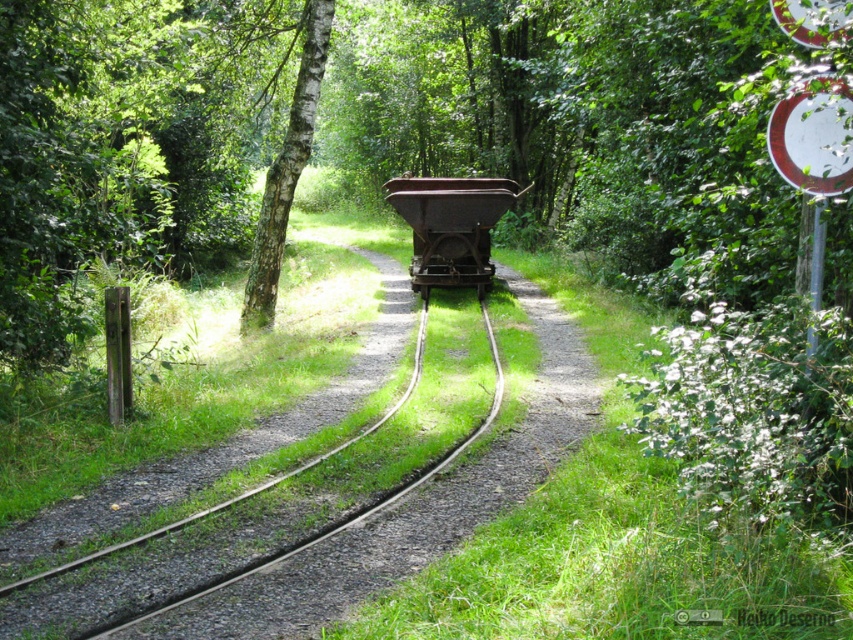
You are a maintenance worker assigned to inspect two rusty metal carts on a railway track. You are standing at the entrance of the track and see the rusty metal train cart at center and the rusty metal cart at center. How far apart are these two carts?

The distance between the rusty metal train cart at center and the rusty metal cart at center is 24.67 feet.

You are standing at the point marked by the coordinates point (451, 227). Looking towards the direction of the railway tracks, which object is directly in front of you?

The rusty metal cart at center is represented by point (451, 227), so the object directly in front of you at that point is the rusty metal cart at center.

You are a photographer standing at the edge of the forest near the railway tracks. You want to take a photo that includes both the rusty metal train cart at center and the rusty metal cart at center. Which cart should you focus on first if you want to ensure both are in sharp focus?

You should focus on the rusty metal train cart at center first because it is closer to the viewer, and focusing on the closer object will help keep both carts in focus when using a narrow aperture or adjusting the depth of field accordingly.